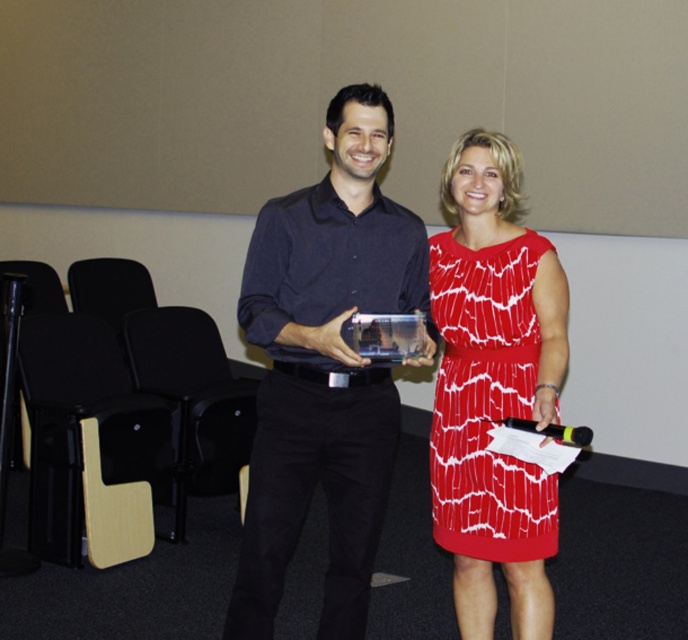
Is matte black shirt at center above red printed dress at center?

Indeed, matte black shirt at center is positioned over red printed dress at center.

Who is shorter, matte black shirt at center or red printed dress at center?

red printed dress at center is shorter.

Identify the location of matte black shirt at center. This screenshot has height=640, width=688. (323, 369).